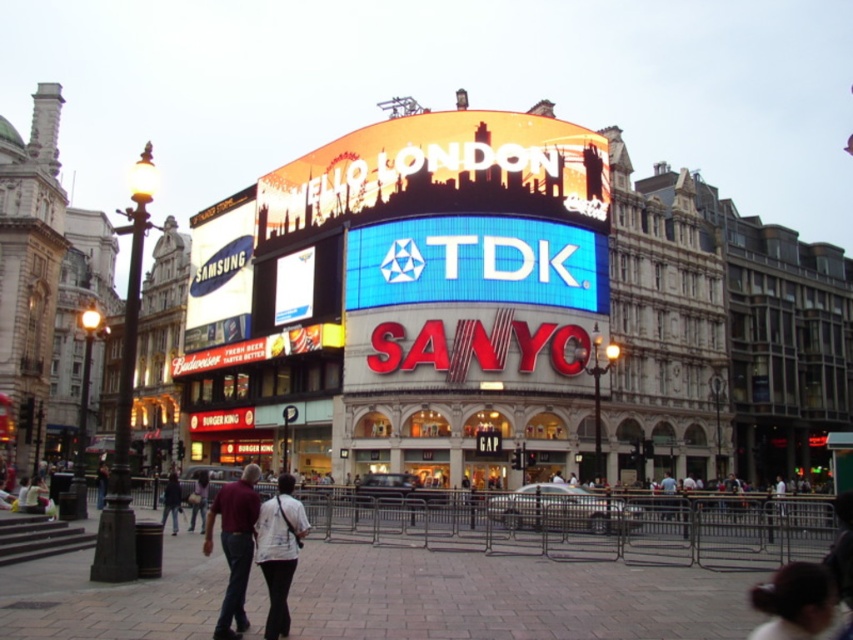
Question: Which object appears farthest from the camera in this image?

Choices:
 (A) dark blue jeans at center
 (B) white fabric shirt at lower center
 (C) matte glass mall at center
 (D) dark blue jacket at center

Answer: (A)

Question: Which of these objects is positioned farthest from the white fabric shirt at lower center?

Choices:
 (A) dark blue jeans at center
 (B) white cotton shirt at center
 (C) dark blue jacket at center

Answer: (A)

Question: Is white fabric shirt at lower center thinner than dark blue jeans at center?

Choices:
 (A) yes
 (B) no

Answer: (B)

Question: Does white cotton shirt at center have a smaller size compared to dark blue jeans at center?

Choices:
 (A) yes
 (B) no

Answer: (B)

Question: Does matte glass mall at center come in front of dark blue jacket at center?

Choices:
 (A) yes
 (B) no

Answer: (A)

Question: Which object is closer to the camera taking this photo?

Choices:
 (A) dark blue jeans at center
 (B) white fabric shirt at lower center

Answer: (B)